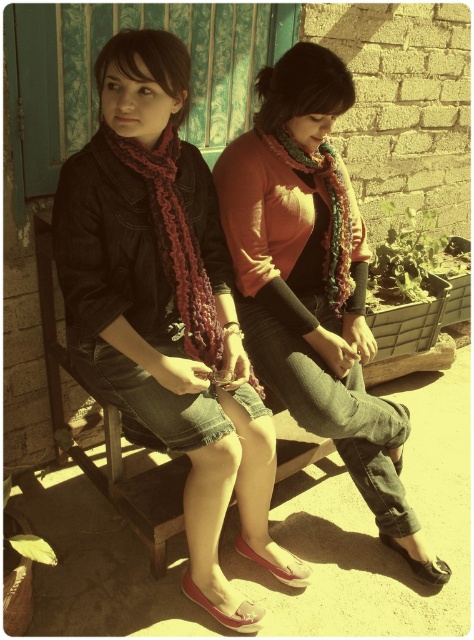
Question: Which of these objects is positioned farthest from the matte pink sandal at lower center?

Choices:
 (A) brown leather sandal at lower right
 (B) ruffled wool scarf at left
 (C) ruffled wool scarf at center

Answer: (C)

Question: Can you confirm if ruffled wool scarf at left is positioned below matte red sandal at lower center?

Choices:
 (A) yes
 (B) no

Answer: (B)

Question: Does multicolored knitted scarf at center have a greater width compared to brown leather sandal at lower right?

Choices:
 (A) no
 (B) yes

Answer: (B)

Question: Does matte pink sandal at lower center have a greater width compared to brown leather sandal at lower right?

Choices:
 (A) yes
 (B) no

Answer: (A)

Question: Among these objects, which one is nearest to the camera?

Choices:
 (A) matte pink sandal at lower center
 (B) multicolored knitted scarf at center
 (C) knitted scarf at center

Answer: (A)

Question: Estimate the real-world distances between objects in this image. Which object is closer to the ruffled wool scarf at left?

Choices:
 (A) matte pink sandal at lower center
 (B) knitted scarf at center

Answer: (B)